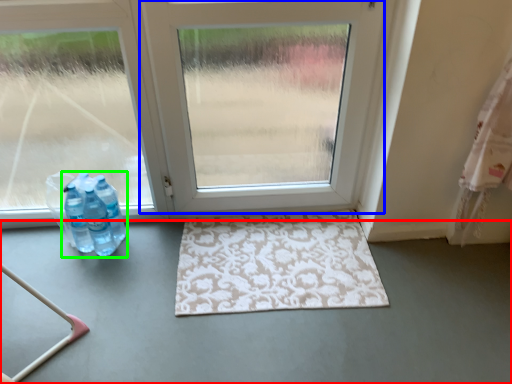
Question: Estimate the real-world distances between objects in this image. Which object is closer to concrete (highlighted by a red box), door (highlighted by a blue box) or bottle (highlighted by a green box)?

Choices:
 (A) door
 (B) bottle

Answer: (B)